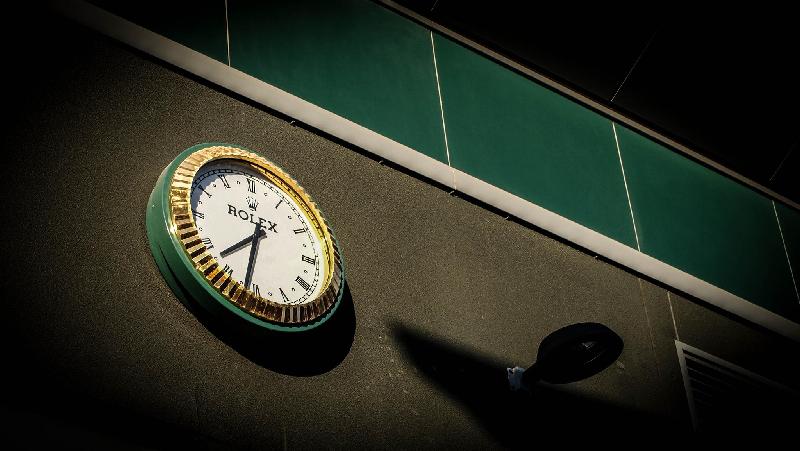
At what (x,y) coordinates should I click in order to perform the action: click on frame. Please return your answer as a coordinate pair (x, y). Looking at the image, I should click on (265, 335).